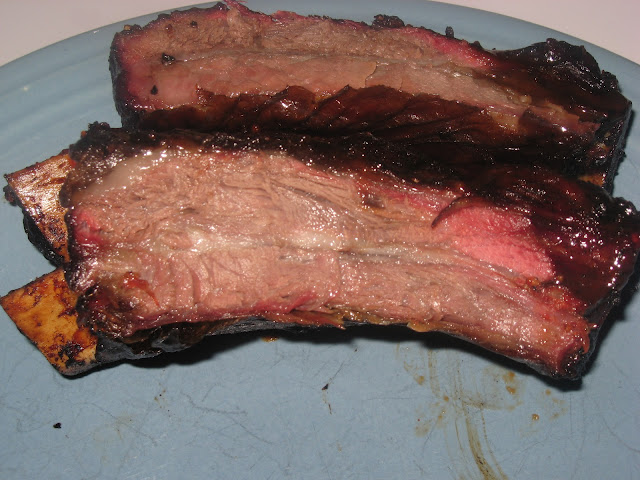
The height and width of the screenshot is (480, 640). Find the location of `plate`. plate is located at coordinates (49, 80), (586, 433).